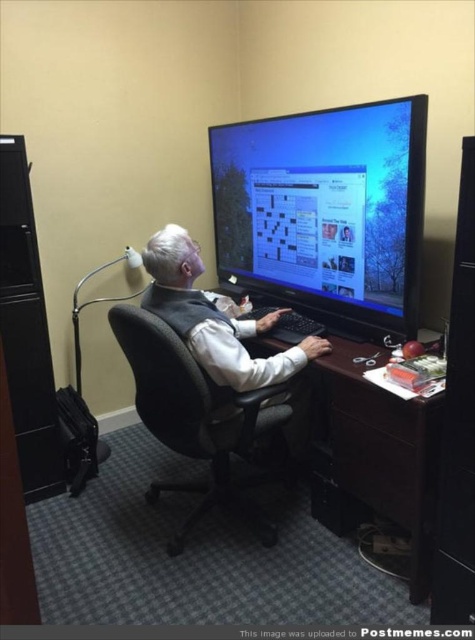
You are a delivery person who needs to place a package on the desk without blocking the monitor or the vest. The package is 18 inches wide. Is there enough space between the matte black monitor at upper center and the white matte vest at center to place it?

The distance between the matte black monitor at upper center and the white matte vest at center is 20.35 inches. Since the package is 18 inches wide, there is sufficient space to place it between them without blocking either object.

What are the coordinates of the matte black monitor at upper center?

The coordinates of the matte black monitor at upper center are 0.331 in the x axis and 0.686 in the y axis.

You are an office worker who needs to adjust your desk height to ensure both the matte black monitor at upper center and the black mesh office chair at center are at comfortable working levels. Considering their height difference, which one should you adjust the desk height to accommodate first?

The matte black monitor at upper center is much taller than the black mesh office chair at center, so you should adjust the desk height to accommodate the monitor first to ensure proper ergonomic alignment.